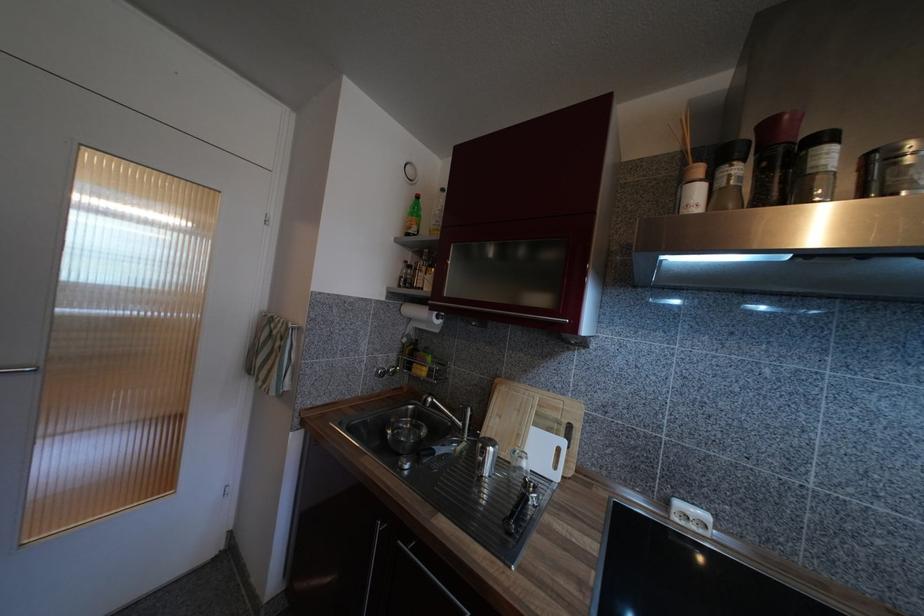
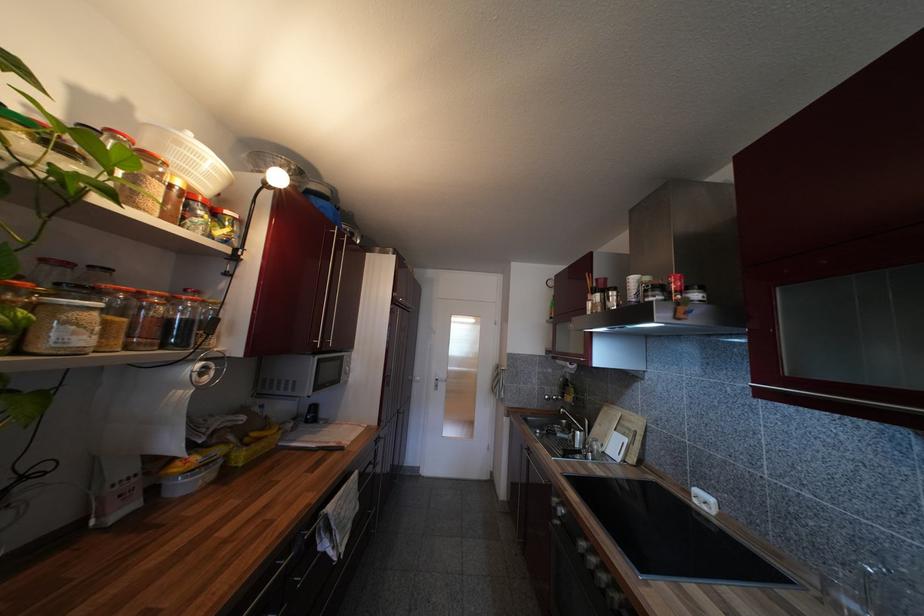
The point at [523,438] is marked in the first image. Where is the corresponding point in the second image?

(610, 438)